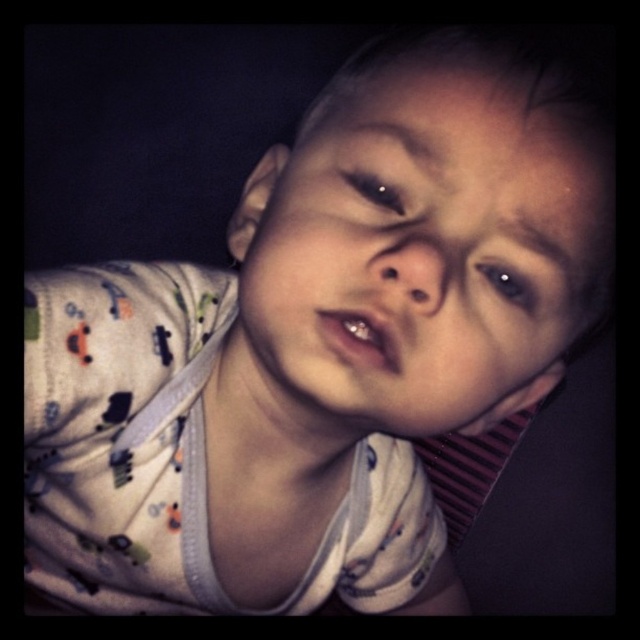
You are a photographer trying to capture the child in the image. You need to adjust the focus to ensure both the brown glossy eye at upper center and the black glossy eye at upper center are clearly visible. Which eye should you focus on first to ensure it is in sharp focus?

The brown glossy eye at upper center is much taller than the black glossy eye at upper center, so focusing on the brown glossy eye at upper center first will ensure its sharpness due to its larger size.

You are a photographer adjusting the focus on your camera. You want to capture a clear image of both the smooth skin face at center and the black glossy eye at upper center. Which object should you focus on first to ensure it appears sharp in the photo?

You should focus on the smooth skin face at center first because it is closer to the viewer than the black glossy eye at upper center, so adjusting focus starting from the closer object ensures sharpness for both.

You are a photographer taking a picture of the child in the image. You want to focus on the point closer to the camera between the two points labeled point (273, 253) and point (504, 298). Which point should you choose?

You should focus on point (273, 253) because it is closer to the camera than point (504, 298).